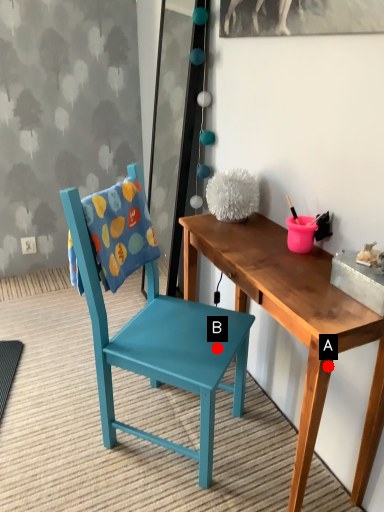
Question: Two points are circled on the image, labeled by A and B beside each circle. Among these points, which one is farthest from the camera?

Choices:
 (A) A is further
 (B) B is further

Answer: (B)